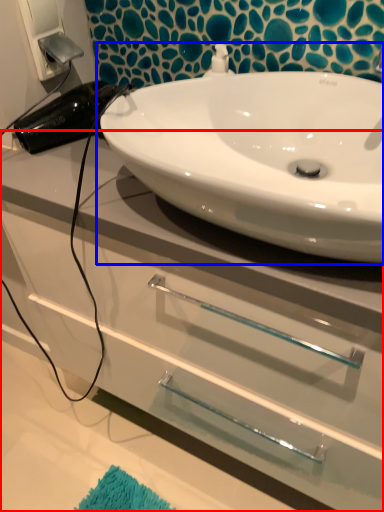
Question: Which object appears farthest to the camera in this image, bathroom cabinet (highlighted by a red box) or sink (highlighted by a blue box)?

Choices:
 (A) bathroom cabinet
 (B) sink

Answer: (A)